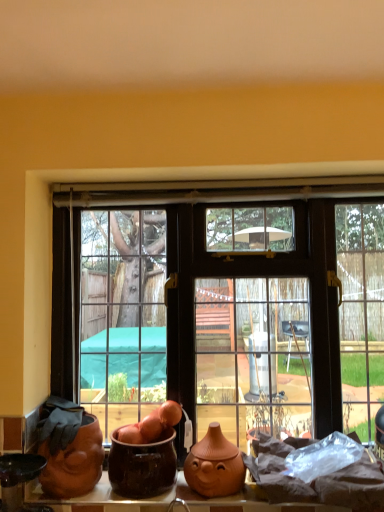
Question: From a real-world perspective, is matte glass window at center on brown glazed pot at center, the 2th pottery when ordered from right to left?

Choices:
 (A) yes
 (B) no

Answer: (A)

Question: Is matte glass window at center positioned in front of brown glazed pot at center, the 2th pottery when ordered from right to left?

Choices:
 (A) no
 (B) yes

Answer: (A)

Question: From the image's perspective, is matte glass window at center over brown glazed pot at center, the 2th pottery when ordered from right to left?

Choices:
 (A) yes
 (B) no

Answer: (A)

Question: Is matte glass window at center oriented away from brown glazed pot at center, positioned as the 2th pottery in left-to-right order?

Choices:
 (A) yes
 (B) no

Answer: (A)

Question: Is brown glazed pot at center, the 2th pottery when ordered from right to left, a part of matte glass window at center?

Choices:
 (A) no
 (B) yes

Answer: (A)

Question: From a real-world perspective, is matte terracotta pot at lower left, arranged as the third pottery when viewed from the right, above or below matte glass window at center?

Choices:
 (A) below
 (B) above

Answer: (A)

Question: In the image, is matte terracotta pot at lower left, which appears as the 1th pottery when viewed from the left, positioned in front of or behind matte glass window at center?

Choices:
 (A) front
 (B) behind

Answer: (A)

Question: Choose the correct answer: Is matte terracotta pot at lower left, arranged as the third pottery when viewed from the right, inside matte glass window at center or outside it?

Choices:
 (A) inside
 (B) outside

Answer: (B)

Question: Is point (92, 450) positioned closer to the camera than point (382, 231)?

Choices:
 (A) closer
 (B) farther

Answer: (A)

Question: Is matte glass window at center taller or shorter than matte orange clay vase at center, the third pottery when ordered from left to right?

Choices:
 (A) short
 (B) tall

Answer: (B)

Question: Would you say matte glass window at center is inside or outside matte orange clay vase at center, the third pottery when ordered from left to right?

Choices:
 (A) inside
 (B) outside

Answer: (B)

Question: Does point (317, 298) appear closer or farther from the camera than point (208, 438)?

Choices:
 (A) closer
 (B) farther

Answer: (B)

Question: Considering the positions of matte glass window at center and matte orange clay vase at center, which appears as the 1th pottery when viewed from the right, in the image, is matte glass window at center wider or thinner than matte orange clay vase at center, which appears as the 1th pottery when viewed from the right,?

Choices:
 (A) thin
 (B) wide

Answer: (A)

Question: From the image's perspective, is matte orange clay vase at center, the third pottery when ordered from left to right, located above or below brown glazed pot at center, the 2th pottery when ordered from right to left?

Choices:
 (A) below
 (B) above

Answer: (A)

Question: Is matte orange clay vase at center, which appears as the 1th pottery when viewed from the right, situated inside brown glazed pot at center, the 2th pottery when ordered from right to left, or outside?

Choices:
 (A) inside
 (B) outside

Answer: (B)